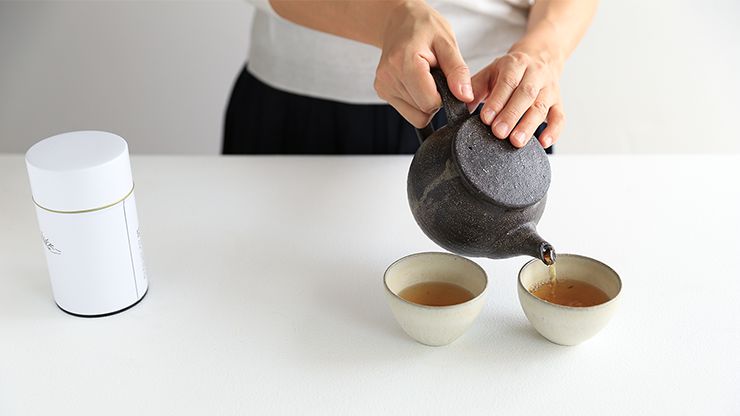
Identify the location of tea in cup to the left of other cup. (419, 290), (445, 293).